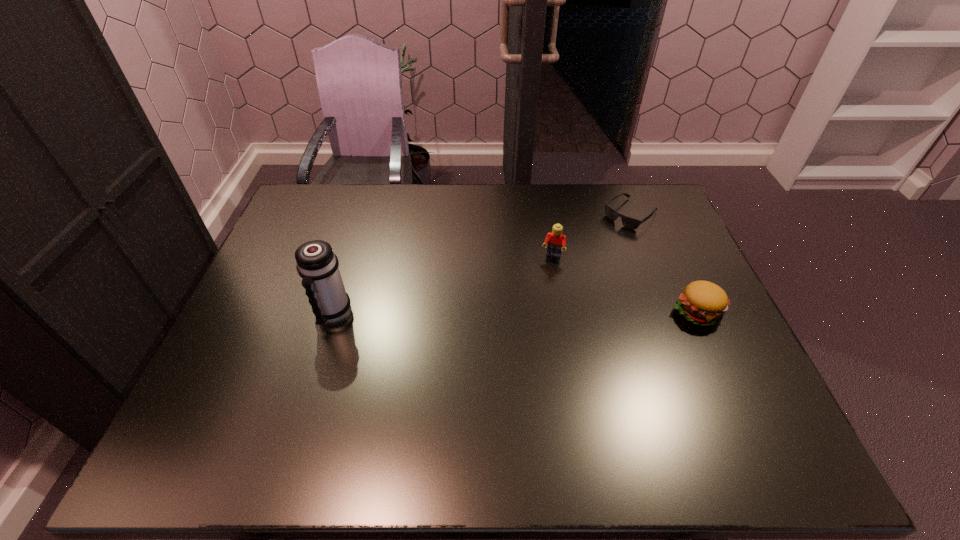
Find the location of a particular element. free space on the desktop that is between the thermos bottle and the hamburger and is positioned on the face of the third object from right to left is located at coordinates (537, 313).

Find the location of a particular element. free space on the desktop that is between the leftmost object and the third tallest object and is positioned on the front-facing side of the farthest object is located at coordinates (510, 313).